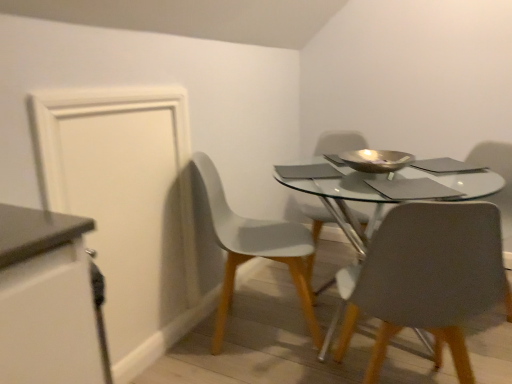
Question: From the image's perspective, is matte gray chair at center, acting as the 3th chair starting from the back, positioned above or below white matte cabinet at left?

Choices:
 (A) above
 (B) below

Answer: (A)

Question: Is point (444, 228) positioned closer to the camera than point (12, 306)?

Choices:
 (A) closer
 (B) farther

Answer: (B)

Question: Which is nearer to the white matte chair at lower left, the second chair when ordered from front to back?

Choices:
 (A) matte gray chair at center, which is counted as the 1th chair, starting from the back
 (B) white matte cabinet at left
 (C) white matte door at left
 (D) metallic gold bowl at center
 (E) matte gray chair at center, acting as the 3th chair starting from the back

Answer: (C)

Question: Based on their relative distances, which object is nearer to the metallic gold bowl at center?

Choices:
 (A) matte gray chair at center, which is counted as the 1th chair, starting from the back
 (B) white matte cabinet at left
 (C) white matte door at left
 (D) white matte chair at lower left, the second chair when ordered from front to back
 (E) matte gray chair at center, acting as the 3th chair starting from the back

Answer: (A)